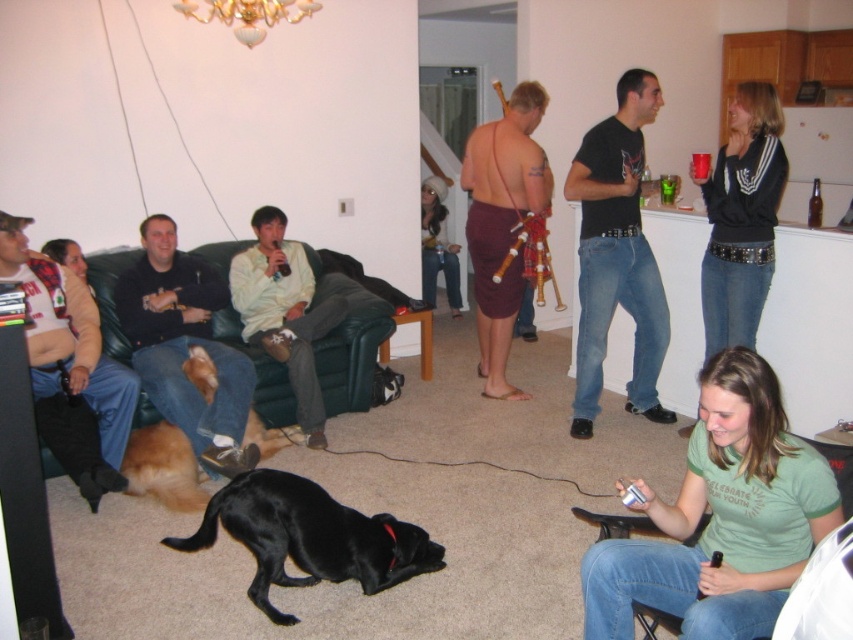
Which is behind, point (430, 548) or point (426, 280)?

The point (426, 280) is more distant.

Identify the location of black smooth dog at lower center. (309, 538).

Does light yellow shirt at center have a greater width compared to denim jeans at center?

Yes.

Can you confirm if light yellow shirt at center is bigger than denim jeans at center?

Indeed, light yellow shirt at center has a larger size compared to denim jeans at center.

Does point (305, 368) come behind point (436, 177)?

No, it is not.

This screenshot has width=853, height=640. In order to click on light yellow shirt at center in this screenshot , I will do `click(283, 310)`.

Is black smooth dog at lower center thinner than green leather couch at left?

Indeed, black smooth dog at lower center has a lesser width compared to green leather couch at left.

Between point (347, 531) and point (294, 412), which one is positioned behind?

The point (294, 412) is more distant.

Does point (321, 541) come behind point (207, 266)?

No, (321, 541) is closer to viewer.

I want to click on black smooth dog at lower center, so click(x=309, y=538).